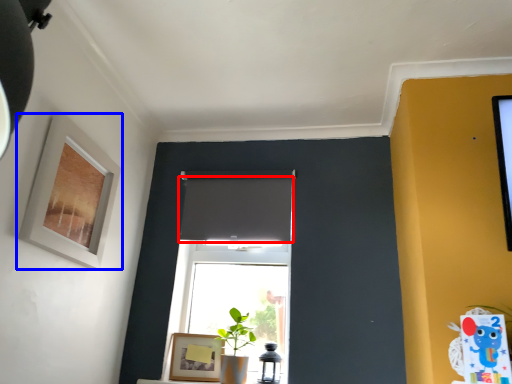
Question: Among these objects, which one is nearest to the camera, curtain (highlighted by a red box) or picture frame (highlighted by a blue box)?

Choices:
 (A) curtain
 (B) picture frame

Answer: (B)